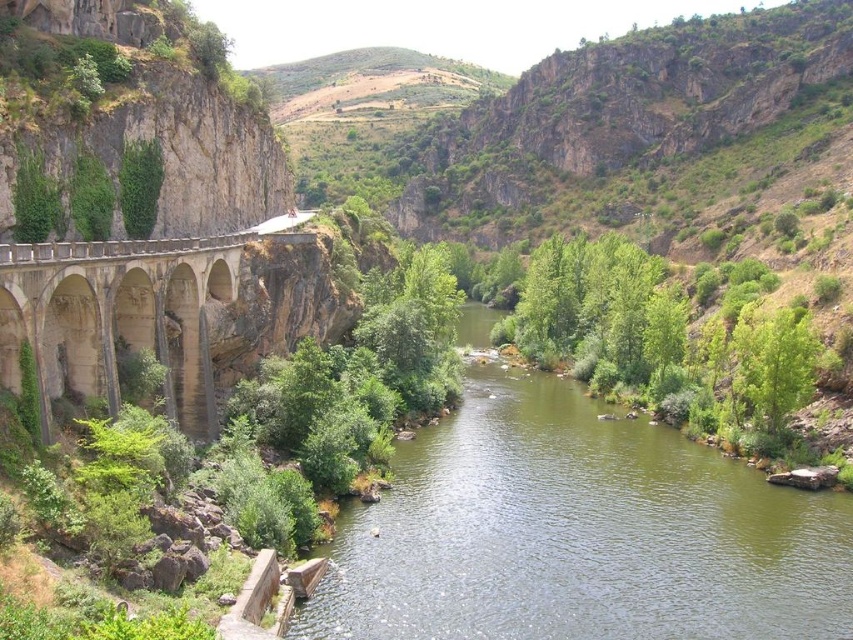
Is green smooth water at center bigger than beige stone bridge at left?

No, green smooth water at center is not bigger than beige stone bridge at left.

Consider the image. Can you confirm if green smooth water at center is positioned below beige stone bridge at left?

Yes, green smooth water at center is below beige stone bridge at left.

Where is `green smooth water at center`? The height and width of the screenshot is (640, 853). green smooth water at center is located at coordinates (578, 532).

The image size is (853, 640). In order to click on green smooth water at center in this screenshot , I will do `click(578, 532)`.